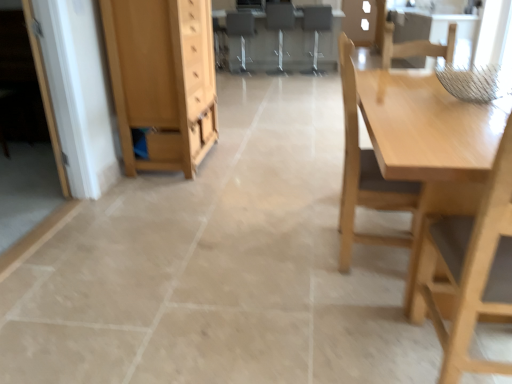
Question: From the image's perspective, is light wood cabinet at left positioned above or below wooden chair at center, which is the 3th chair from back to front?

Choices:
 (A) below
 (B) above

Answer: (A)

Question: Is point (188, 39) positioned closer to the camera than point (314, 71)?

Choices:
 (A) farther
 (B) closer

Answer: (B)

Question: Which object is the farthest from the metallic silver chair at center, positioned as the 4th chair in front-to-back order?

Choices:
 (A) matte gray computer desk at center
 (B) matte wood drawer at center
 (C) light wood cabinet at left
 (D) white glossy door at left
 (E) light wood chair at right, the first chair viewed from the front

Answer: (E)

Question: Considering the real-world distances, which object is closest to the wooden chair at center, which is the second chair in right-to-left order?

Choices:
 (A) matte wood drawer at center
 (B) white glossy door at left
 (C) metallic gray chair at center, positioned as the fifth chair in front-to-back order
 (D) matte gray computer desk at center
 (E) light wood cabinet at left

Answer: (D)